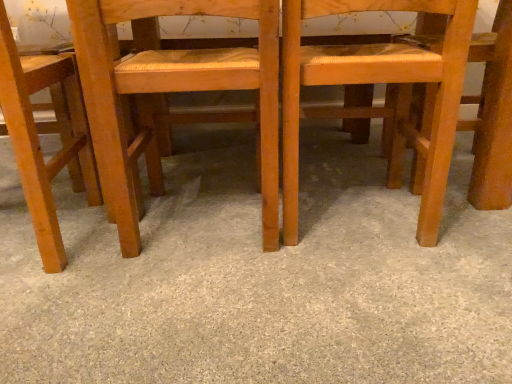
Question: Is wooden chair at center, the 2th chair when ordered from right to left, completely or partially outside of matte wood chair at left, which is the third chair in right-to-left order?

Choices:
 (A) yes
 (B) no

Answer: (A)

Question: Can you confirm if wooden chair at center, the 2th chair when ordered from right to left, is thinner than matte wood chair at left, which is the third chair in right-to-left order?

Choices:
 (A) no
 (B) yes

Answer: (A)

Question: Can you confirm if wooden chair at center, the 2th chair in the left-to-right sequence, is taller than matte wood chair at left, the first chair in the left-to-right sequence?

Choices:
 (A) yes
 (B) no

Answer: (B)

Question: Can you confirm if wooden chair at center, the 2th chair when ordered from right to left, is positioned to the right of matte wood chair at left, the first chair in the left-to-right sequence?

Choices:
 (A) no
 (B) yes

Answer: (B)

Question: Could matte wood chair at left, the first chair in the left-to-right sequence, be considered to be inside wooden chair at center, the 2th chair when ordered from right to left?

Choices:
 (A) yes
 (B) no

Answer: (B)

Question: Would you say wooden chair at center, which is counted as the third chair, starting from the left, is inside or outside gray carpet at center?

Choices:
 (A) outside
 (B) inside

Answer: (A)

Question: Considering the positions of point (440, 132) and point (325, 302), is point (440, 132) closer or farther from the camera than point (325, 302)?

Choices:
 (A) farther
 (B) closer

Answer: (A)

Question: In terms of width, does wooden chair at center, which is counted as the third chair, starting from the left, look wider or thinner when compared to gray carpet at center?

Choices:
 (A) wide
 (B) thin

Answer: (B)

Question: In the image, is wooden chair at center, the 1th chair in the right-to-left sequence, on the left side or the right side of gray carpet at center?

Choices:
 (A) right
 (B) left

Answer: (A)

Question: From a real-world perspective, is matte wood chair at left, which is the third chair in right-to-left order, physically located above or below gray carpet at center?

Choices:
 (A) above
 (B) below

Answer: (A)

Question: Relative to gray carpet at center, is matte wood chair at left, which is the third chair in right-to-left order, in front or behind?

Choices:
 (A) behind
 (B) front

Answer: (A)

Question: From the image's perspective, is matte wood chair at left, the first chair in the left-to-right sequence, located above or below gray carpet at center?

Choices:
 (A) below
 (B) above

Answer: (B)

Question: In terms of height, does matte wood chair at left, the first chair in the left-to-right sequence, look taller or shorter compared to gray carpet at center?

Choices:
 (A) short
 (B) tall

Answer: (B)

Question: Based on their sizes in the image, would you say wooden chair at center, the 2th chair in the left-to-right sequence, is bigger or smaller than matte wood chair at left, which is the third chair in right-to-left order?

Choices:
 (A) big
 (B) small

Answer: (A)

Question: From a real-world perspective, is wooden chair at center, the 2th chair in the left-to-right sequence, physically located above or below matte wood chair at left, which is the third chair in right-to-left order?

Choices:
 (A) above
 (B) below

Answer: (B)